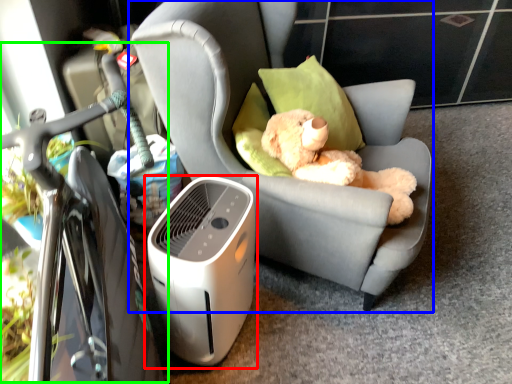
Question: Considering the real-world distances, which object is farthest from home appliance (highlighted by a red box)? chair (highlighted by a blue box) or bicycle (highlighted by a green box)?

Choices:
 (A) chair
 (B) bicycle

Answer: (A)